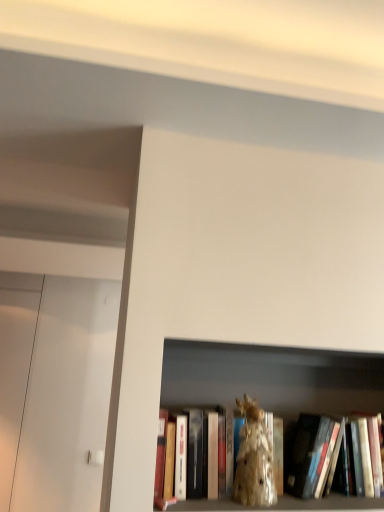
Question: Considering the relative sizes of gold metallic statue at center and shiny gold statue at center in the image provided, is gold metallic statue at center bigger than shiny gold statue at center?

Choices:
 (A) yes
 (B) no

Answer: (A)

Question: Does gold metallic statue at center lie in front of shiny gold statue at center?

Choices:
 (A) no
 (B) yes

Answer: (A)

Question: Can you confirm if gold metallic statue at center is shorter than shiny gold statue at center?

Choices:
 (A) no
 (B) yes

Answer: (A)

Question: Can shiny gold statue at center be found inside gold metallic statue at center?

Choices:
 (A) yes
 (B) no

Answer: (A)

Question: From the image's perspective, would you say gold metallic statue at center is positioned over shiny gold statue at center?

Choices:
 (A) no
 (B) yes

Answer: (A)

Question: Can you confirm if gold metallic statue at center is positioned to the right of shiny gold statue at center?

Choices:
 (A) yes
 (B) no

Answer: (A)

Question: From a real-world perspective, is shiny gold statue at center located higher than gold metallic statue at center?

Choices:
 (A) yes
 (B) no

Answer: (B)

Question: Can you confirm if shiny gold statue at center is smaller than gold metallic statue at center?

Choices:
 (A) no
 (B) yes

Answer: (B)

Question: Considering the relative sizes of shiny gold statue at center and gold metallic statue at center in the image provided, is shiny gold statue at center wider than gold metallic statue at center?

Choices:
 (A) no
 (B) yes

Answer: (A)

Question: From a real-world perspective, is shiny gold statue at center below gold metallic statue at center?

Choices:
 (A) yes
 (B) no

Answer: (A)

Question: Can you confirm if shiny gold statue at center is thinner than gold metallic statue at center?

Choices:
 (A) no
 (B) yes

Answer: (B)

Question: Is shiny gold statue at center turned away from gold metallic statue at center?

Choices:
 (A) no
 (B) yes

Answer: (B)

Question: Is shiny gold statue at center wider or thinner than gold metallic statue at center?

Choices:
 (A) wide
 (B) thin

Answer: (B)